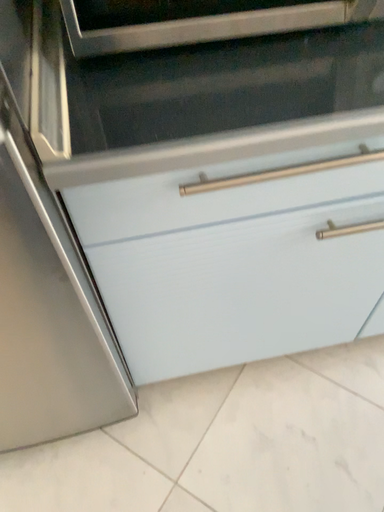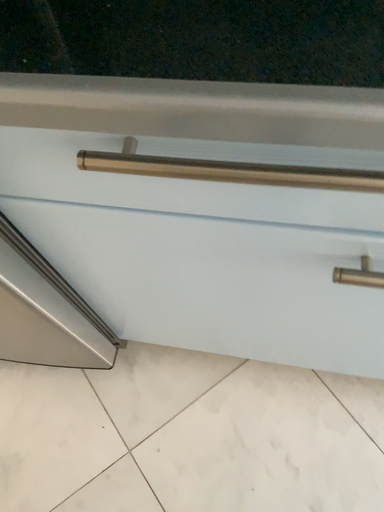
Question: Which way did the camera rotate in the video?

Choices:
 (A) rotated downward
 (B) rotated upward

Answer: (A)